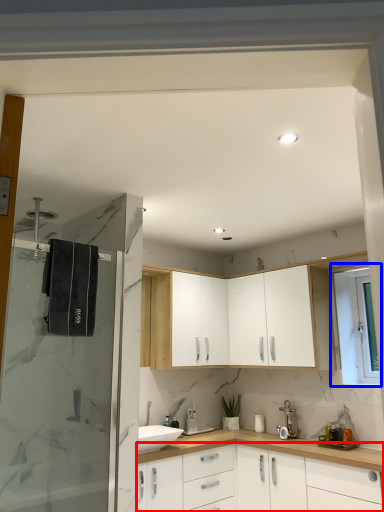
Question: Which of the following is the closest to the observer, cabinetry (highlighted by a red box) or window (highlighted by a blue box)?

Choices:
 (A) cabinetry
 (B) window

Answer: (A)